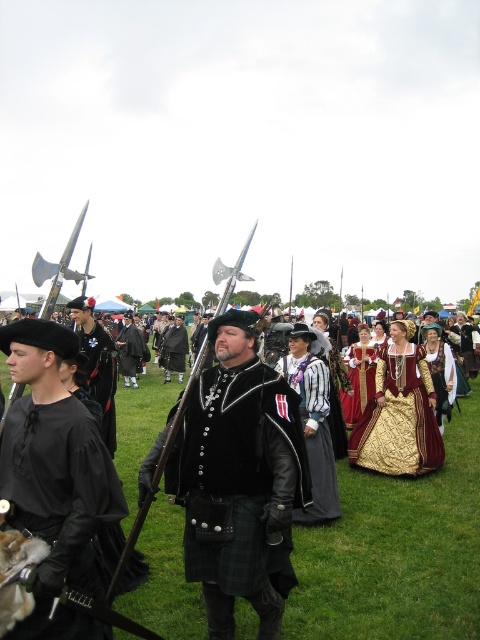
You are a costume designer observing the historical reenactment event. You notice two central costumes in the image. Which one is located to the left of the other? The velvet black vest at center and the striped fabric dress at center are both in the center area. Please determine their relative positions.

The velvet black vest at center is positioned on the left side of striped fabric dress at center, so the velvet black vest at center is to the left of the striped fabric dress at center.

You are a photographer at the historical reenactment event. You want to take a photo that includes both the point at coordinates point (321, 371) and point (105, 426). Which point should you focus on to ensure both are in sharp focus?

You should focus on point (321, 371) because it is closer to the camera, ensuring both points will be in focus as the depth of field will cover the distance between them.

You are a photographer positioned at the edge of the field. You want to take a photo that includes both the black matte shirt at left and the black velvet hat at center. Which object should you adjust your camera focus on first to ensure both are in the frame?

The black matte shirt at left is closer to the viewer than the black velvet hat at center, so you should focus on the black matte shirt at left first to ensure both are in the frame.